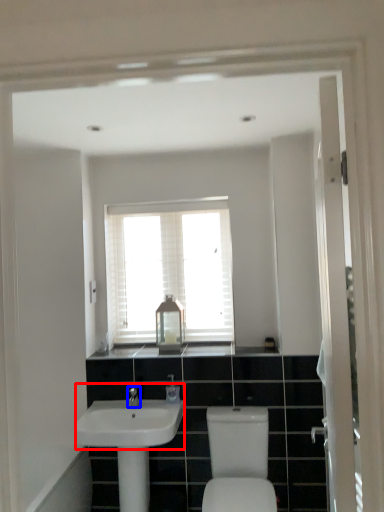
Question: Among these objects, which one is farthest to the camera, sink (highlighted by a red box) or tap (highlighted by a blue box)?

Choices:
 (A) sink
 (B) tap

Answer: (B)